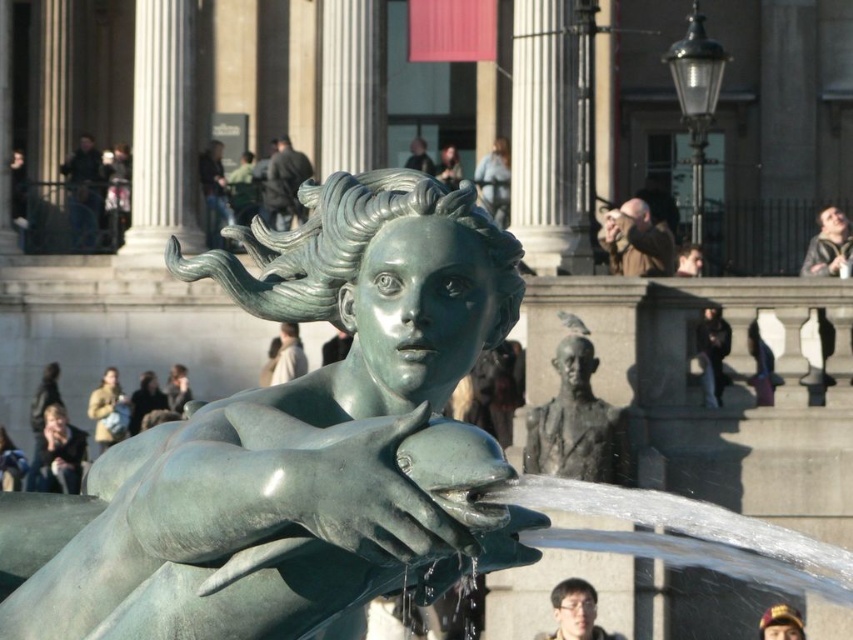
Question: Considering the real-world distances, which object is farthest from the green patina statue at center?

Choices:
 (A) matte black cap at lower right
 (B) bronze statue at center
 (C) light brown leather jacket at lower left

Answer: (C)

Question: Does green patina statue at center have a lesser width compared to matte black cap at lower right?

Choices:
 (A) yes
 (B) no

Answer: (B)

Question: Which of these objects is positioned farthest from the matte black cap at lower right?

Choices:
 (A) light brown hair at upper right
 (B) green patina statue at center
 (C) light brown leather jacket at lower left
 (D) matte black glasses at lower center

Answer: (B)

Question: From the image, what is the correct spatial relationship of matte black glasses at lower center in relation to light brown leather jacket at lower left?

Choices:
 (A) above
 (B) below

Answer: (B)

Question: Among these objects, which one is nearest to the camera?

Choices:
 (A) light brown leather jacket at lower left
 (B) bronze statue at center
 (C) matte black glasses at lower center
 (D) light brown hair at upper right

Answer: (C)

Question: Is light brown leather jacket at lower left thinner than matte black cap at lower right?

Choices:
 (A) yes
 (B) no

Answer: (B)